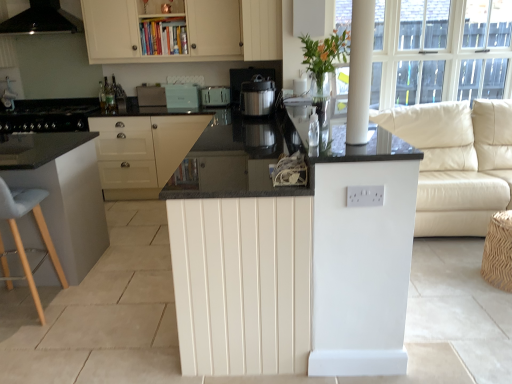
The height and width of the screenshot is (384, 512). Find the location of `vacant area that lies in front of white glossy pillar at upper right`. vacant area that lies in front of white glossy pillar at upper right is located at coordinates (367, 161).